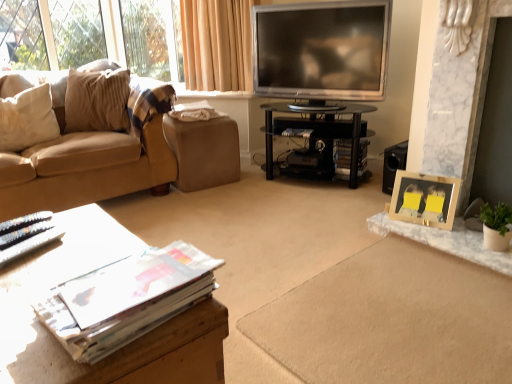
Image resolution: width=512 pixels, height=384 pixels. Identify the location of vacant space in front of wooden photo frame at right. (436, 230).